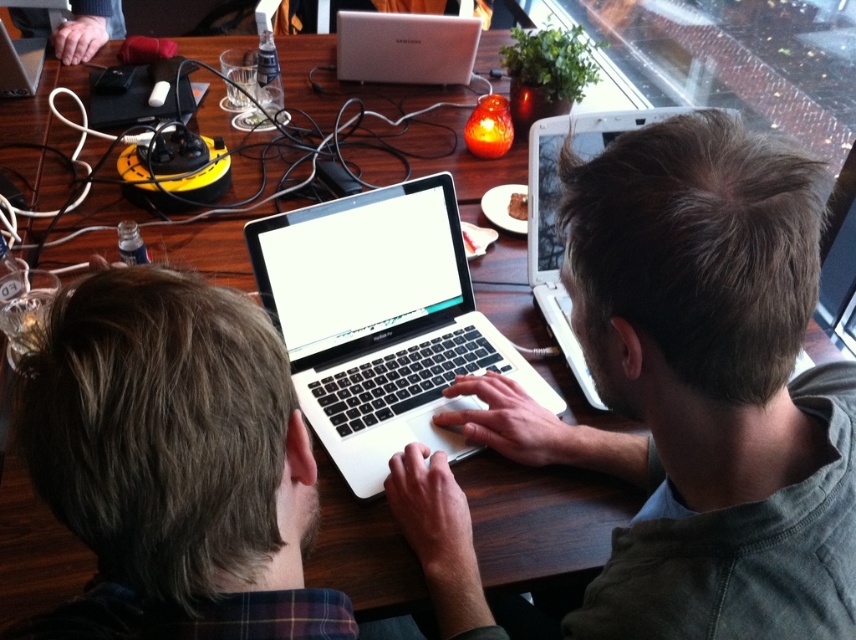
Who is positioned more to the right, silver metallic laptop at upper center or satin silver laptop at upper center?

silver metallic laptop at upper center is more to the right.

Is point (539, 291) closer to camera compared to point (456, 83)?

Yes.

You are a GUI agent. You are given a task and a screenshot of the screen. Output one action in this format:
    pyautogui.click(x=<x>, y=<y>)
    Task: Click on the silver metallic laptop at upper center
    The height and width of the screenshot is (640, 856).
    Given the screenshot: What is the action you would take?
    (557, 212)

Based on the photo, who is lower down, matte black laptop at center or silver metallic laptop at upper center?

matte black laptop at center

The height and width of the screenshot is (640, 856). What do you see at coordinates (699, 388) in the screenshot?
I see `matte black laptop at center` at bounding box center [699, 388].

This screenshot has height=640, width=856. Identify the location of matte black laptop at center. (699, 388).

How distant is silver/black matte laptop at center from silver metallic laptop at upper center?

A distance of 8.82 inches exists between silver/black matte laptop at center and silver metallic laptop at upper center.

Does silver/black matte laptop at center come in front of silver metallic laptop at upper center?

No, silver/black matte laptop at center is further to the viewer.

Does point (343, 285) lie behind point (581, 385)?

That is False.

The width and height of the screenshot is (856, 640). Find the location of `silver/black matte laptop at center`. silver/black matte laptop at center is located at coordinates (379, 321).